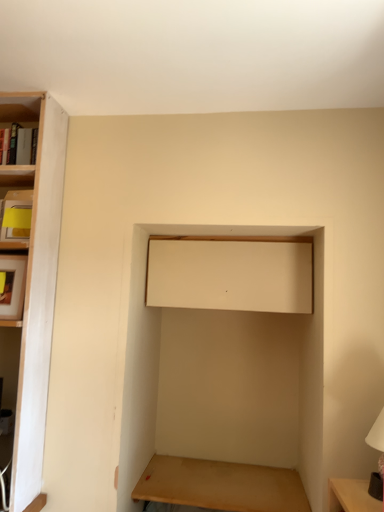
Question: From a real-world perspective, is beige matte cabinet at upper center over white glossy table lamp at lower right?

Choices:
 (A) yes
 (B) no

Answer: (A)

Question: Can you confirm if beige matte cabinet at upper center is smaller than white glossy table lamp at lower right?

Choices:
 (A) yes
 (B) no

Answer: (B)

Question: From a real-world perspective, is beige matte cabinet at upper center beneath white glossy table lamp at lower right?

Choices:
 (A) no
 (B) yes

Answer: (A)

Question: Is beige matte cabinet at upper center looking in the opposite direction of white glossy table lamp at lower right?

Choices:
 (A) yes
 (B) no

Answer: (B)

Question: Is beige matte cabinet at upper center thinner than white glossy table lamp at lower right?

Choices:
 (A) no
 (B) yes

Answer: (A)

Question: Is wooden table at lower center bigger or smaller than beige matte cabinet at upper center?

Choices:
 (A) small
 (B) big

Answer: (A)

Question: Considering the positions of wooden table at lower center and beige matte cabinet at upper center in the image, is wooden table at lower center taller or shorter than beige matte cabinet at upper center?

Choices:
 (A) short
 (B) tall

Answer: (A)

Question: Considering the positions of point (163, 455) and point (175, 284), is point (163, 455) closer or farther from the camera than point (175, 284)?

Choices:
 (A) closer
 (B) farther

Answer: (B)

Question: From the image's perspective, is wooden table at lower center positioned above or below beige matte cabinet at upper center?

Choices:
 (A) above
 (B) below

Answer: (B)

Question: In terms of height, does white glossy table lamp at lower right look taller or shorter compared to wooden table at lower center?

Choices:
 (A) short
 (B) tall

Answer: (B)

Question: Considering the positions of white glossy table lamp at lower right and wooden table at lower center in the image, is white glossy table lamp at lower right bigger or smaller than wooden table at lower center?

Choices:
 (A) big
 (B) small

Answer: (B)

Question: Choose the correct answer: Is white glossy table lamp at lower right inside wooden table at lower center or outside it?

Choices:
 (A) outside
 (B) inside

Answer: (A)

Question: From the image's perspective, is white glossy table lamp at lower right positioned above or below wooden table at lower center?

Choices:
 (A) below
 (B) above

Answer: (B)

Question: From the image's perspective, relative to beige matte cabinet at upper center, is white glossy table lamp at lower right above or below?

Choices:
 (A) below
 (B) above

Answer: (A)

Question: Based on their positions, is white glossy table lamp at lower right located to the left or right of beige matte cabinet at upper center?

Choices:
 (A) left
 (B) right

Answer: (B)